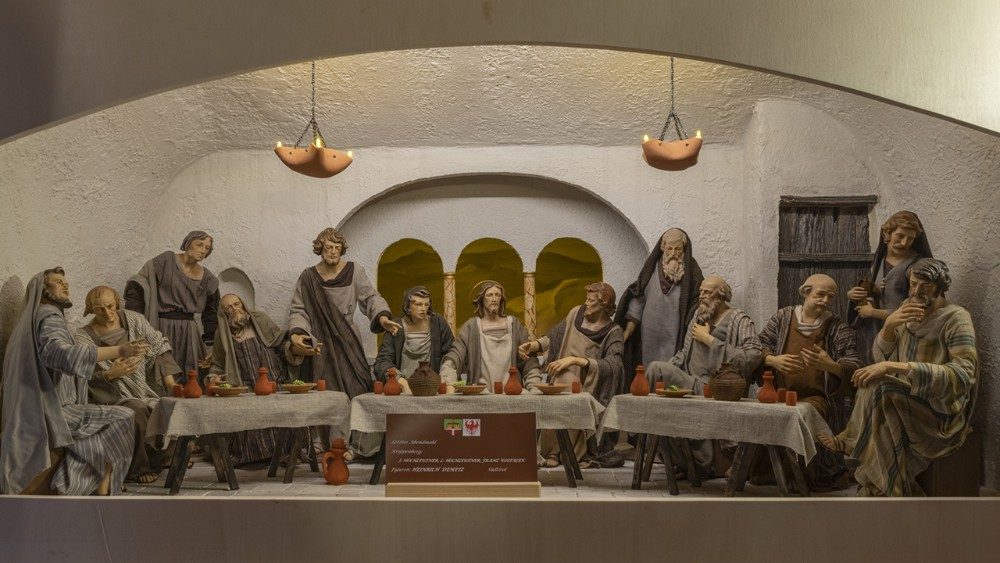
Find the location of a particular element. This screenshot has width=1000, height=563. bowl is located at coordinates (237, 388), (300, 388), (469, 390), (551, 388), (671, 391).